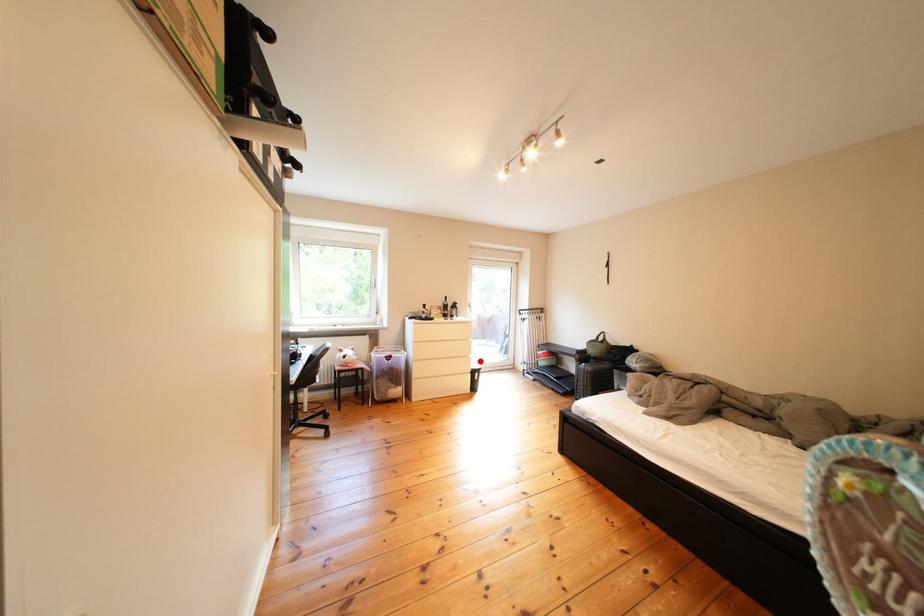
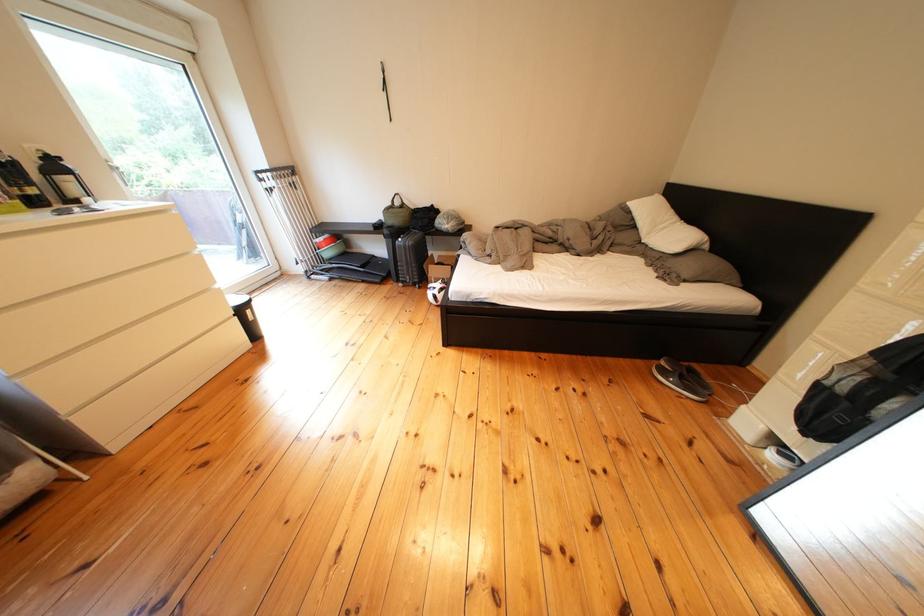
In the second image, find the point that corresponds to the highlighted location in the first image.

(220, 294)